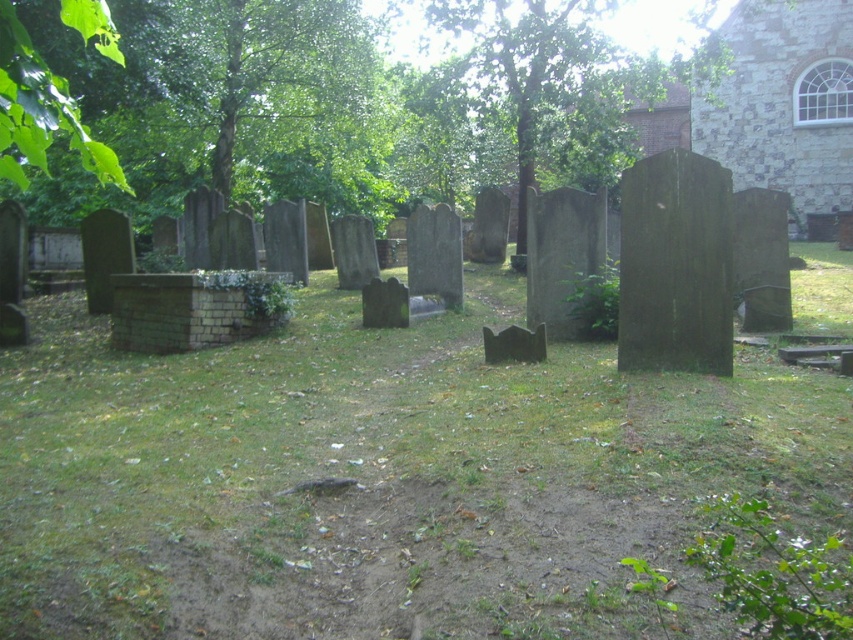
Question: Which object is farther from the camera taking this photo?

Choices:
 (A) green grass at center
 (B) green leafy tree at upper center
 (C) brown stone church at upper right

Answer: (C)

Question: Observing the image, what is the correct spatial positioning of brown stone church at upper right in reference to green leafy tree at upper center?

Choices:
 (A) above
 (B) below

Answer: (B)

Question: Which is farther from the brown stone church at upper right?

Choices:
 (A) green grass at center
 (B) green leafy tree at upper center

Answer: (A)

Question: Estimate the real-world distances between objects in this image. Which object is farther from the green grass at center?

Choices:
 (A) brown stone church at upper right
 (B) green leafy tree at upper center

Answer: (A)

Question: Is brown stone church at upper right thinner than green leafy tree at upper center?

Choices:
 (A) yes
 (B) no

Answer: (A)

Question: Is green grass at center below green leafy tree at upper center?

Choices:
 (A) no
 (B) yes

Answer: (B)